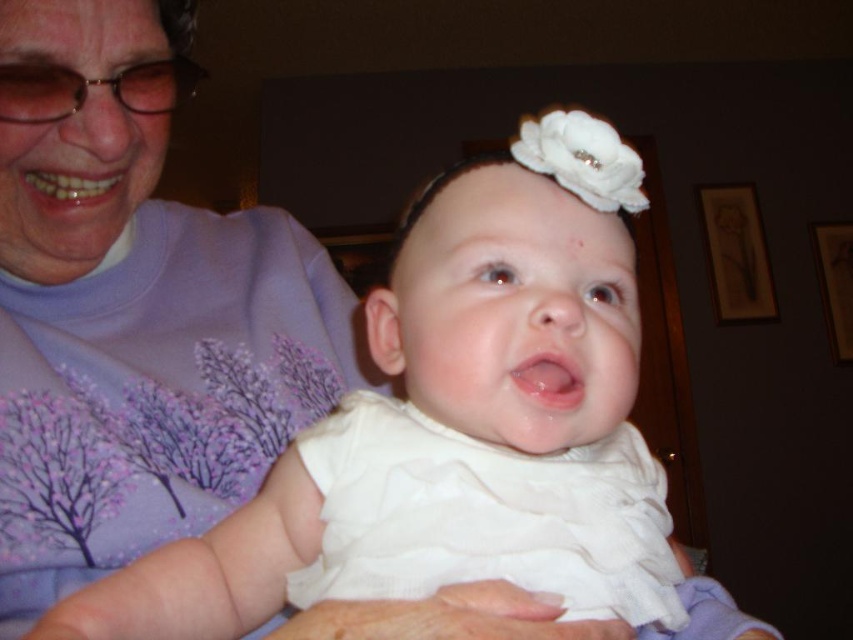
Who is more distant from viewer, (x=538, y=548) or (x=74, y=346)?

Positioned behind is point (x=74, y=346).

The image size is (853, 640). Describe the element at coordinates (456, 422) in the screenshot. I see `white satin dress at center` at that location.

The image size is (853, 640). I want to click on white satin dress at center, so click(x=456, y=422).